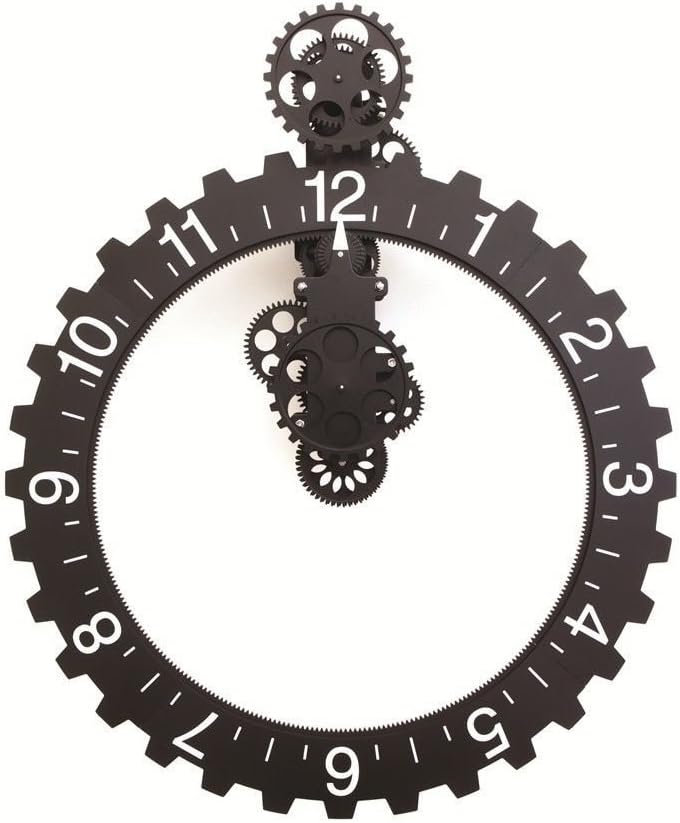
Locate an element on the screen. Image resolution: width=680 pixels, height=823 pixels. background within clock is located at coordinates (337, 598).